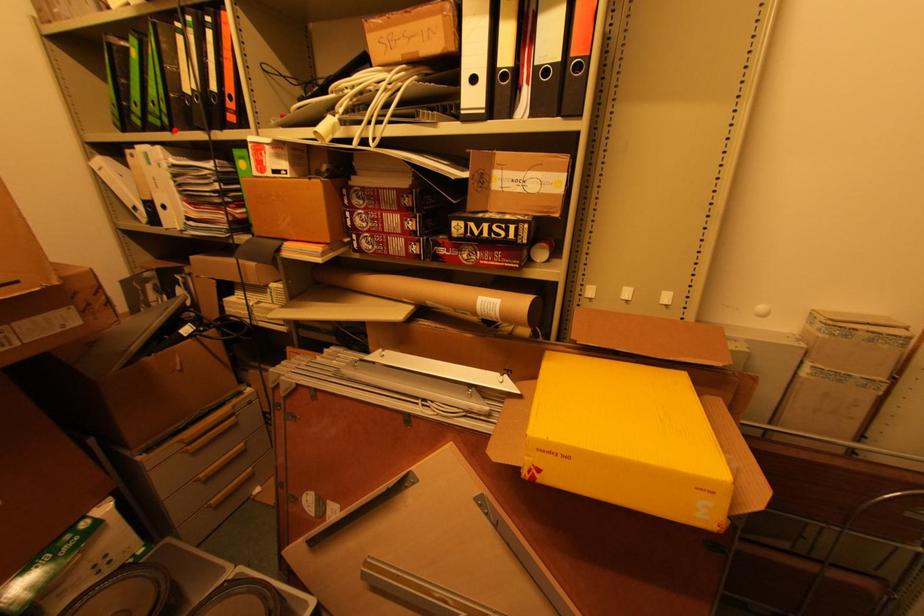
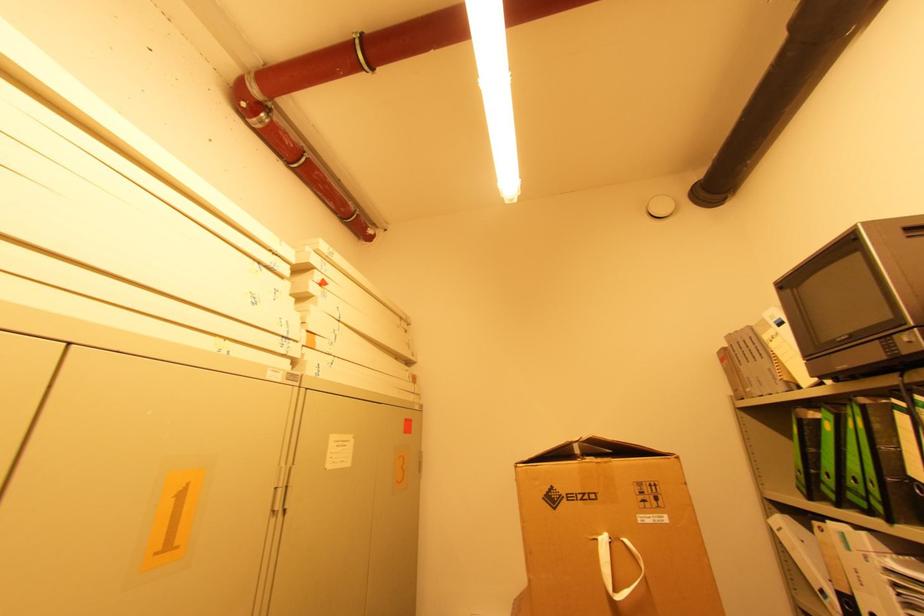
Find the pixel in the second image that matches the highlighted location in the first image.

(894, 522)